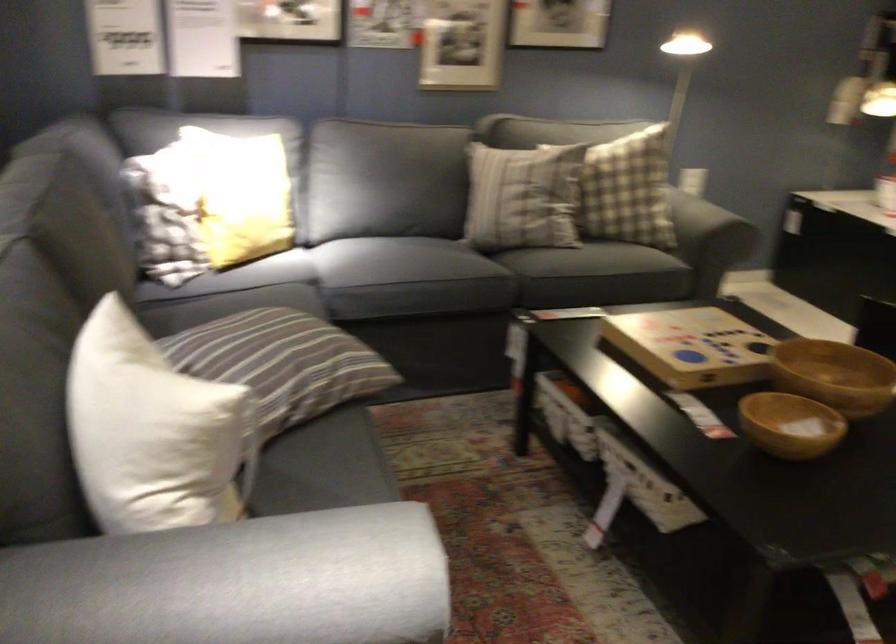
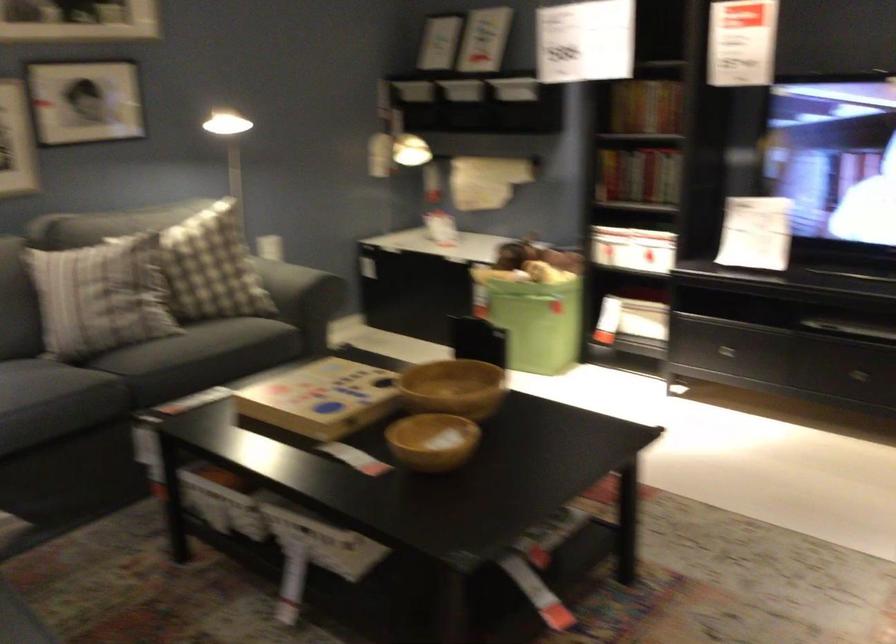
Where in the second image is the point corresponding to the point at 703,220 from the first image?

(286, 285)